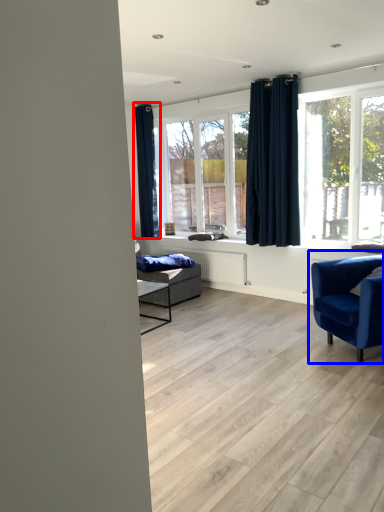
Question: Which object is closer to the camera taking this photo, curtain (highlighted by a red box) or chair (highlighted by a blue box)?

Choices:
 (A) curtain
 (B) chair

Answer: (B)